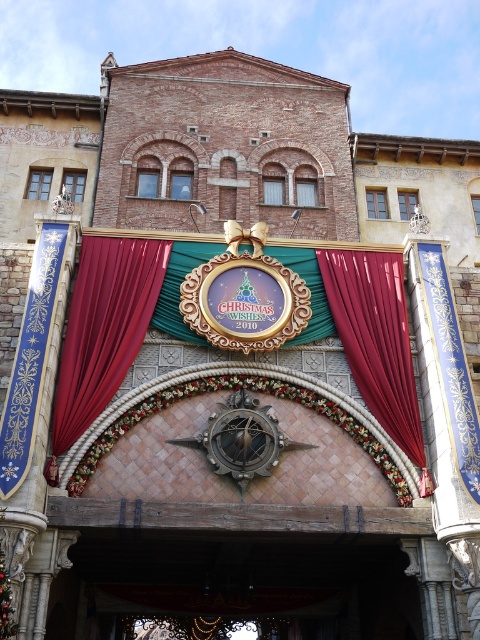
Between wooden door at center and red velvet curtain at center, which one has less height?

red velvet curtain at center

In the scene shown: Does wooden door at center appear on the left side of red velvet curtain at center?

Correct, you'll find wooden door at center to the left of red velvet curtain at center.

Is point (347, 550) more distant than point (331, 248)?

No, it is in front of (331, 248).

This screenshot has height=640, width=480. What are the coordinates of `wooden door at center` in the screenshot? It's located at (242, 566).

Is point (396, 545) closer to camera compared to point (99, 301)?

Yes, point (396, 545) is closer to viewer.

Between point (68, 548) and point (73, 307), which one is positioned in front?

Point (68, 548) is in front.

Which is in front, point (71, 528) or point (99, 381)?

Point (71, 528)

I want to click on wooden door at center, so click(242, 566).

Can you confirm if velvet red curtain at center is positioned below red velvet curtain at center?

Actually, velvet red curtain at center is above red velvet curtain at center.

Does velvet red curtain at center appear on the left side of red velvet curtain at center?

Yes, velvet red curtain at center is to the left of red velvet curtain at center.

Measure the distance between point (91, 356) and camera.

Point (91, 356) and camera are 142.32 feet apart from each other.

Identify the location of velvet red curtain at center. (104, 326).